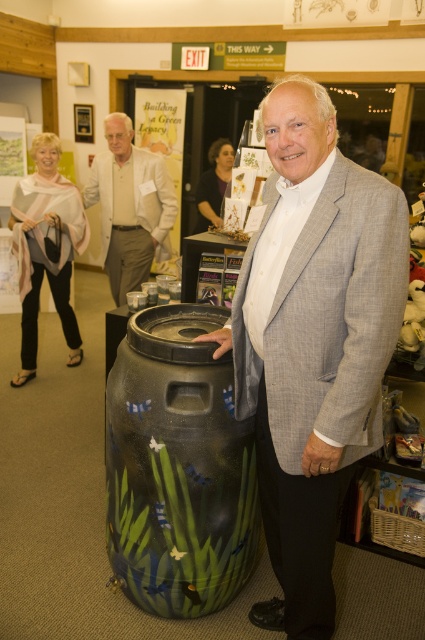
You are a photographer at the event and need to position a light to the left of both the painted ceramic barrel at center and the white textured suit at center. Is this possible given their current arrangement?

The painted ceramic barrel at center is already to the right of the white textured suit at center, so placing a light to the left of both would be possible as the white textured suit at center is on the left side of the barrel. Position the light to the left of the white textured suit at center and it will also be to the left of the barrel.

What are the coordinates of the gray wool suit at center in the image?

The gray wool suit at center is located at coordinates (312, 340).

You are a photographer trying to capture a group photo of the attendees in the scene. The gray wool suit at center and the light gray scarf at left are two key subjects. What is the minimum distance you need to set your camera lens to ensure both subjects are in focus simultaneously?

The minimum distance required is 2.27 meters, as that is the distance between the gray wool suit at center and the light gray scarf at left.